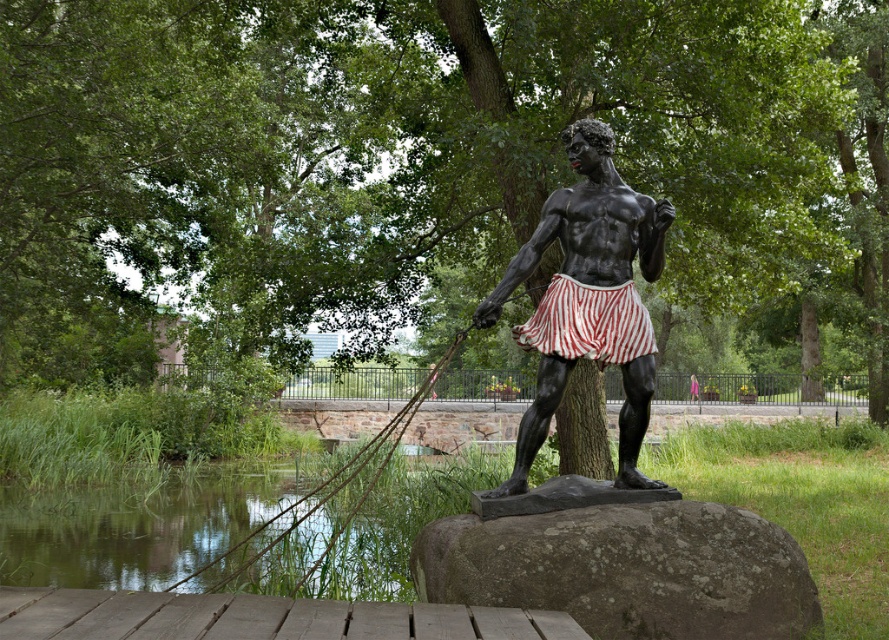
Does clear water at lower left appear under black glossy statue at center?

Yes.

From the picture: Between clear water at lower left and black glossy statue at center, which one is positioned lower?

Positioned lower is clear water at lower left.

In order to click on clear water at lower left in this screenshot , I will do `click(135, 525)`.

At what (x,y) coordinates should I click in order to perform the action: click on black glossy statue at center. Please return your answer as a coordinate pair (x, y). The height and width of the screenshot is (640, 889). Looking at the image, I should click on (589, 298).

Is black glossy statue at center further to the viewer compared to roperough at right?

Yes, black glossy statue at center is behind roperough at right.

Is point (597, 209) in front of point (362, 467)?

Yes.

Where is `black glossy statue at center`? This screenshot has height=640, width=889. black glossy statue at center is located at coordinates (589, 298).

From the picture: Between rough gray rock at center and black glossy statue at center, which one is positioned higher?

black glossy statue at center is above.

You are a GUI agent. You are given a task and a screenshot of the screen. Output one action in this format:
    pyautogui.click(x=<x>, y=<y>)
    Task: Click on the rough gray rock at center
    Image resolution: width=889 pixels, height=640 pixels.
    Given the screenshot: What is the action you would take?
    pyautogui.click(x=626, y=570)